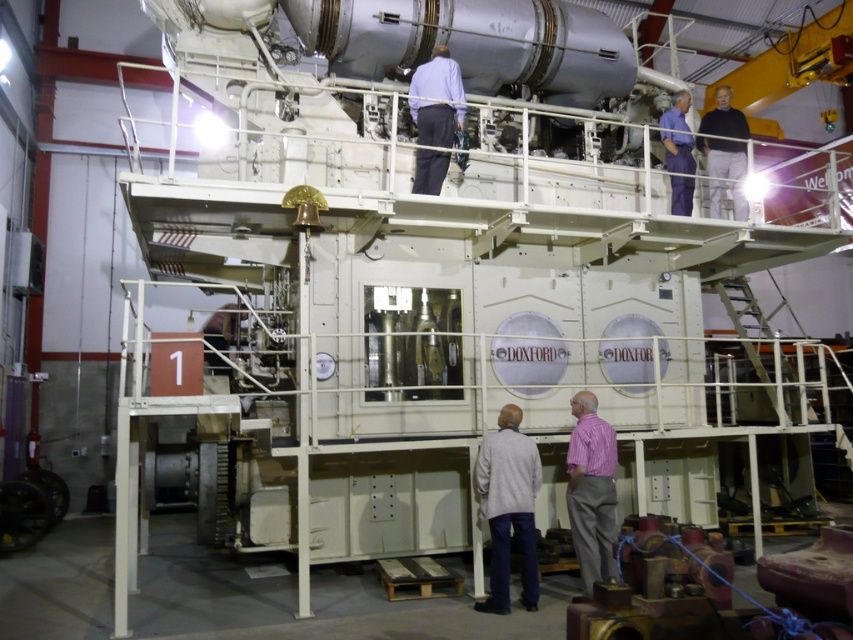
You are a maintenance worker standing at the entrance of the factory. You need to reach the light gray fabric shirt at lower center to hand over a tool. Is the distance within your comfortable reaching range?

The light gray fabric shirt at lower center is 5.86 meters away from the viewer. Since the average comfortable reaching distance for a maintenance worker is typically around 1.5 to 2 meters, the distance is too far to comfortably reach. You would need to move closer or use a tool with an extended handle to reach it.

You are standing in front of the DOXFOR machine and want to determine which of the two points, point (577, 468) or point (672, 145), is nearer to you. Based on the image, which point is closer?

Point (577, 468) is closer to the camera than point (672, 145), so the point (577, 468) is nearer to you.

You are an inspector at the factory and need to check both the pink cotton shirt at lower center and the matte blue shirt at upper center. Which shirt should you inspect first if you want to start with the one that is more to the left?

The pink cotton shirt at lower center is positioned on the left side of matte blue shirt at upper center, so you should inspect the pink cotton shirt at lower center first.